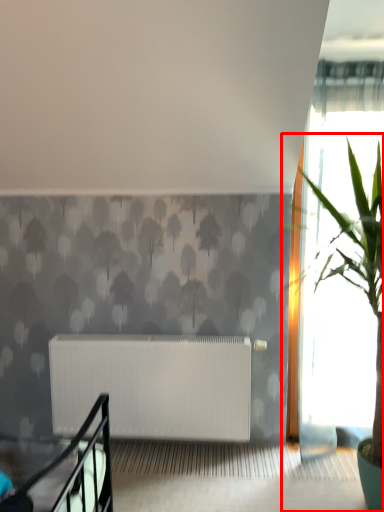
Question: From the image, what is the correct spatial relationship of houseplant (annotated by the red box) in relation to radiator?

Choices:
 (A) right
 (B) left

Answer: (A)